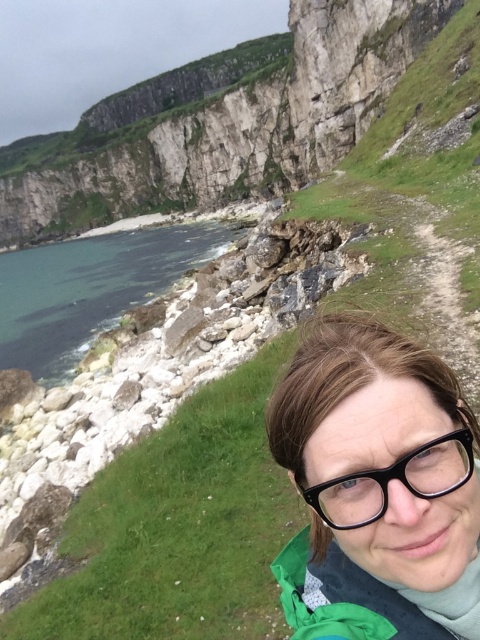
You are a photographer positioned at the point marked as point (x=377, y=486). You want to capture a clear shot of the cliffs in the background. However, there is an object at your current position that might obstruct your view. What is the object blocking your view?

The object at point (x=377, y=486) is matte black glasses at lower right, which is blocking your view of the cliffs in the background.

You are standing at the point closer to the camera between the two points, point (334, 518) and point (317, 497). Which point are you standing at?

You are standing at point (334, 518) because it is further to the camera than point (317, 497).

You are a photographer trying to capture both the matte black glasses at lower right and the black plastic glasses at center in a single shot. Which glasses are located to the right of the other?

The matte black glasses at lower right is positioned on the right side of black plastic glasses at center.